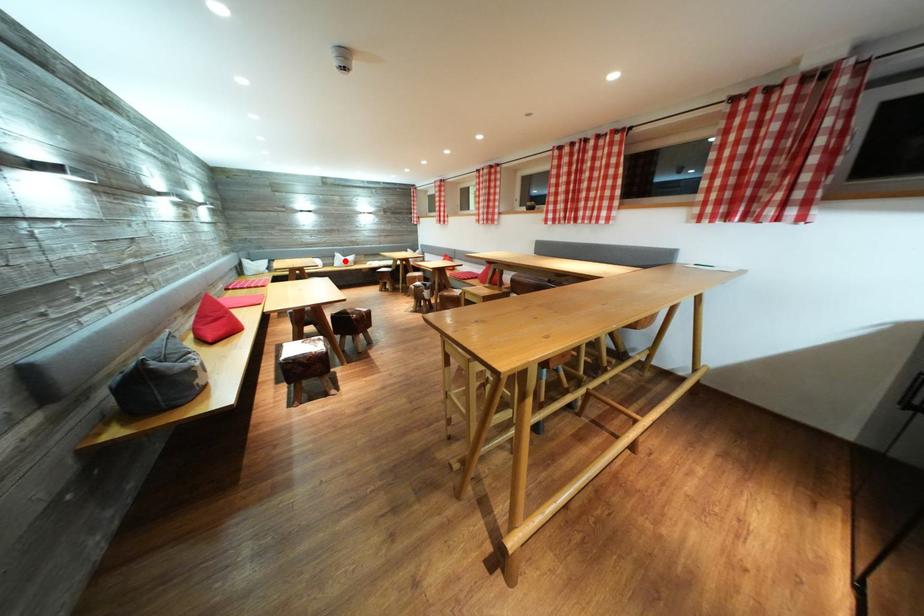
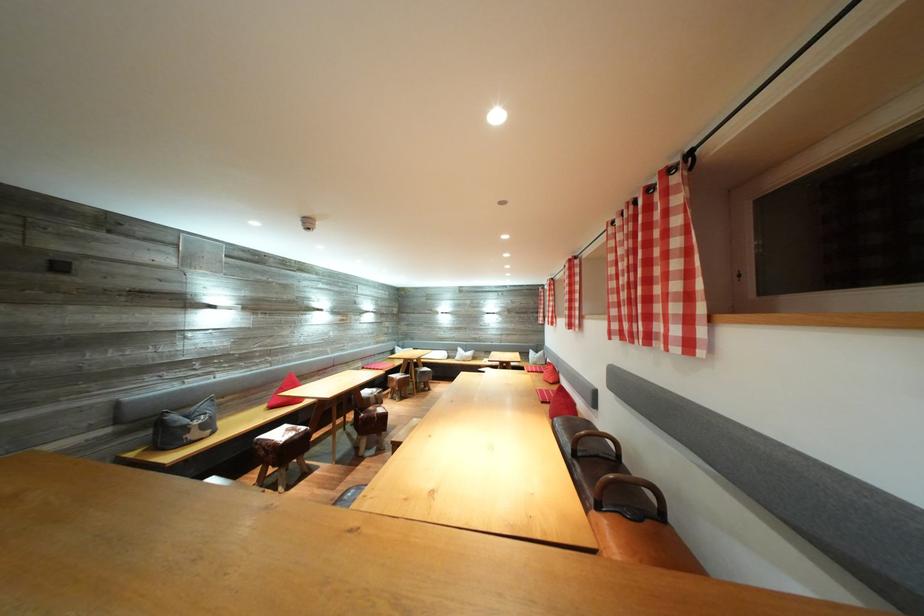
Where in the second image is the point corresponding to the highlighted location from the first image?

(467, 355)